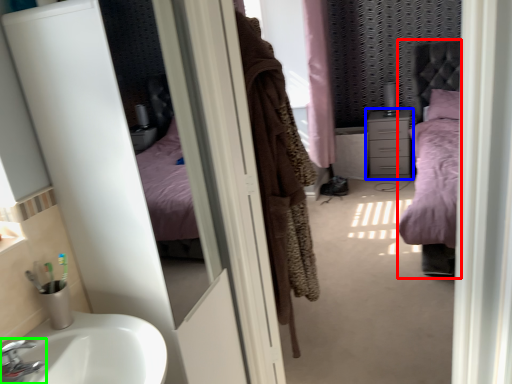
Question: Estimate the real-world distances between objects in this image. Which object is farther from bed (highlighted by a red box), chest of drawers (highlighted by a blue box) or tap (highlighted by a green box)?

Choices:
 (A) chest of drawers
 (B) tap

Answer: (B)